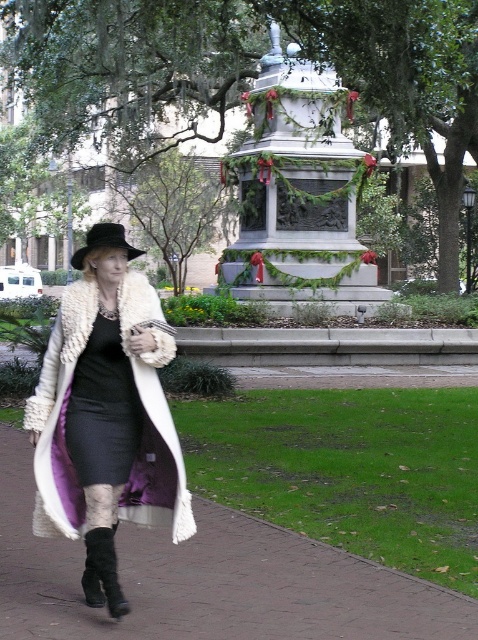
Question: Which object is positioned closest to the black felt fedora at center?

Choices:
 (A) white fur coat at left
 (B) smooth concrete pavement at lower center

Answer: (B)

Question: Which point is closer to the camera taking this photo?

Choices:
 (A) (97, 464)
 (B) (15, 529)
 (C) (83, 266)
 (D) (65, 428)

Answer: (A)

Question: Is smooth concrete pavement at lower center closer to camera compared to white fur coat at left?

Choices:
 (A) no
 (B) yes

Answer: (B)

Question: Is black satin dress at center to the left of black felt fedora at center from the viewer's perspective?

Choices:
 (A) no
 (B) yes

Answer: (A)

Question: From the image, what is the correct spatial relationship of smooth concrete pavement at lower center in relation to black felt fedora at center?

Choices:
 (A) left
 (B) right

Answer: (B)

Question: Which point is farther to the camera?

Choices:
 (A) white fur coat at left
 (B) black felt fedora at center
 (C) black satin dress at center
 (D) smooth concrete pavement at lower center

Answer: (B)